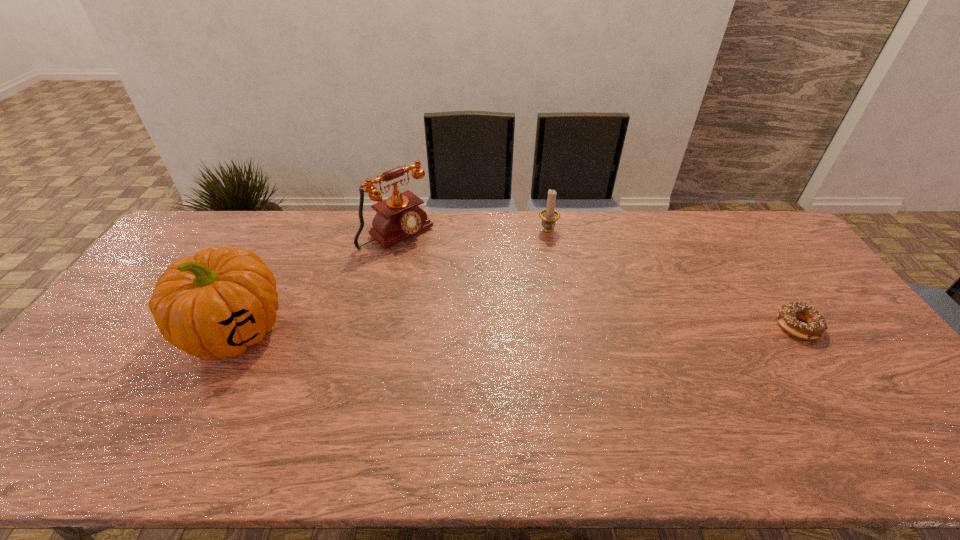
Find the location of a particular element. This screenshot has height=540, width=960. vacant space at the far left corner of the desktop is located at coordinates (183, 231).

Locate an element on the screen. vacant space in between the leftmost object and the telephone is located at coordinates (316, 281).

Where is `unoccupied position between the candle_holder and the doughnut`? unoccupied position between the candle_holder and the doughnut is located at coordinates (673, 279).

I want to click on vacant area between the second object from left to right and the leftmost object, so click(x=316, y=281).

You are a GUI agent. You are given a task and a screenshot of the screen. Output one action in this format:
    pyautogui.click(x=<x>, y=<y>)
    Task: Click on the free spot between the leftmost object and the shortest object
    This screenshot has height=540, width=960.
    Given the screenshot: What is the action you would take?
    pyautogui.click(x=516, y=328)

Image resolution: width=960 pixels, height=540 pixels. Identify the location of free space between the telephone and the shortest object. (597, 279).

Find the location of a particular element. The image size is (960, 540). free area in between the shortest object and the pumpkin is located at coordinates (516, 328).

Locate an element on the screen. The width and height of the screenshot is (960, 540). vacant space that's between the pumpkin and the second object from right to left is located at coordinates (392, 281).

Image resolution: width=960 pixels, height=540 pixels. What are the coordinates of `vacant area between the doughnut and the candle_holder` in the screenshot? It's located at (673, 279).

This screenshot has width=960, height=540. I want to click on vacant space that's between the third object from left to right and the leftmost object, so click(x=392, y=281).